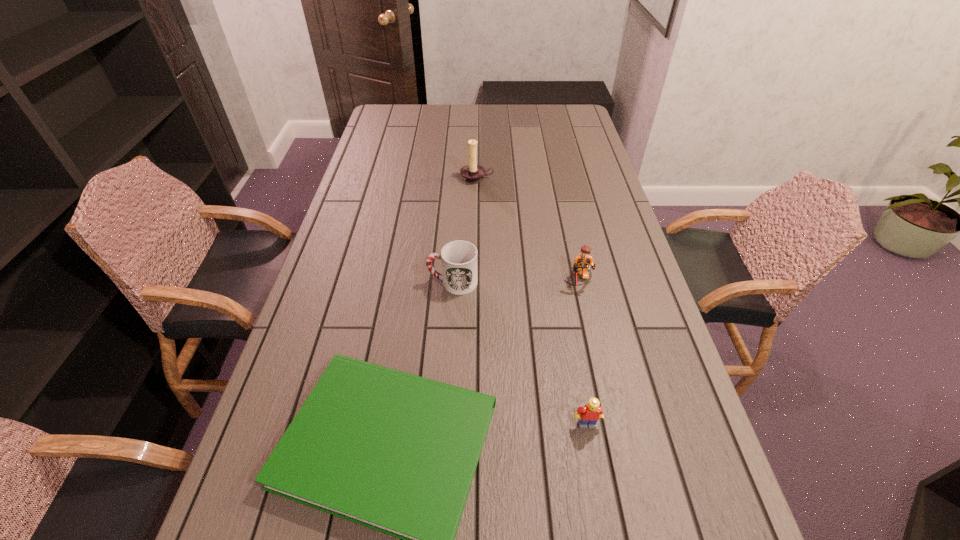
At what (x,y) coordinates should I click in order to perform the action: click on free space located on the front-facing side of the nearer Lego. Please return your answer as a coordinate pair (x, y). The image size is (960, 540). Looking at the image, I should click on (592, 453).

Where is `object at the right edge`? This screenshot has height=540, width=960. object at the right edge is located at coordinates (583, 262).

The image size is (960, 540). What are the coordinates of `free location at the left edge` in the screenshot? It's located at (383, 190).

The width and height of the screenshot is (960, 540). Identify the location of vacant area at the right edge of the desktop. (558, 156).

You are a GUI agent. You are given a task and a screenshot of the screen. Output one action in this format:
    pyautogui.click(x=<x>, y=<y>)
    Task: Click on the free space at the far left corner of the desktop
    Image resolution: width=960 pixels, height=540 pixels.
    Given the screenshot: What is the action you would take?
    pyautogui.click(x=385, y=111)

The height and width of the screenshot is (540, 960). Find the location of `blank space at the far right corner`. blank space at the far right corner is located at coordinates (578, 118).

Find the location of `vacant area between the farther Lego and the cup`. vacant area between the farther Lego and the cup is located at coordinates (516, 282).

The width and height of the screenshot is (960, 540). In order to click on free point between the cup and the candle holder in this screenshot , I will do `click(465, 230)`.

The image size is (960, 540). Find the location of `vacant area that lies between the farther Lego and the candle holder`. vacant area that lies between the farther Lego and the candle holder is located at coordinates (528, 230).

This screenshot has height=540, width=960. Find the location of `vacant space that's between the nearer Lego and the farther Lego`. vacant space that's between the nearer Lego and the farther Lego is located at coordinates (583, 353).